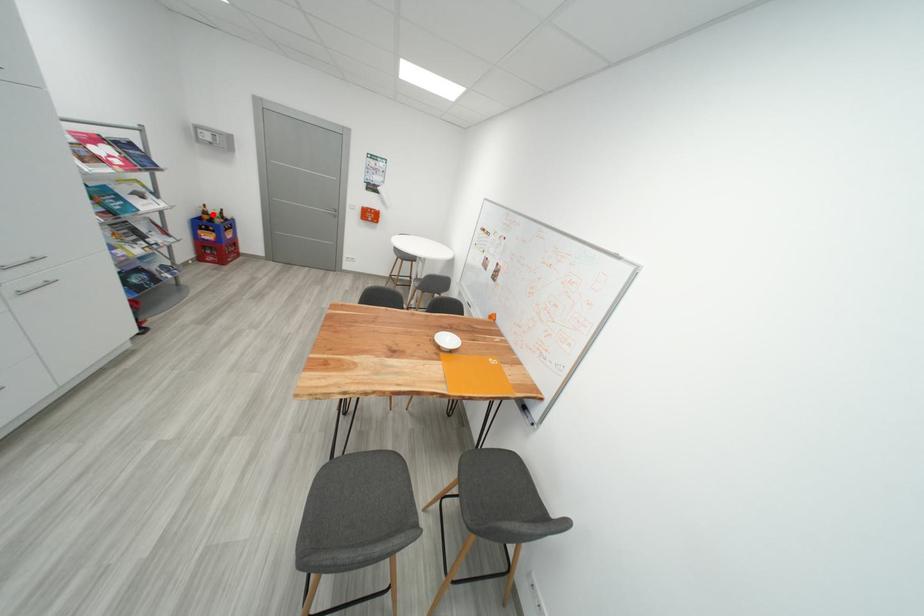
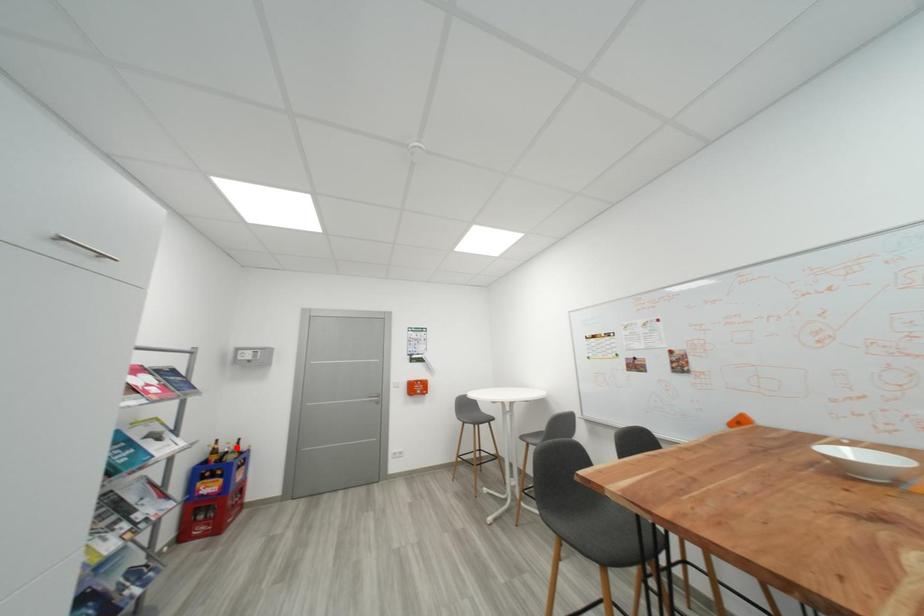
I am providing you with two images of the same scene from different viewpoints. A red point is marked on the first image and another point is marked on the second image. Is the red point in image1 aligned with the point shown in image2?

No